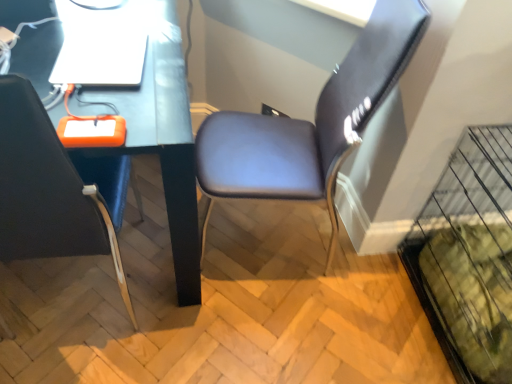
You are a GUI agent. You are given a task and a screenshot of the screen. Output one action in this format:
    pyautogui.click(x=<x>, y=<y>)
    Task: Click on the free space in front of suede-like brown chair at center-right, which appears as the 2th chair when viewed from the left
    The image size is (512, 384).
    Given the screenshot: What is the action you would take?
    pyautogui.click(x=264, y=324)